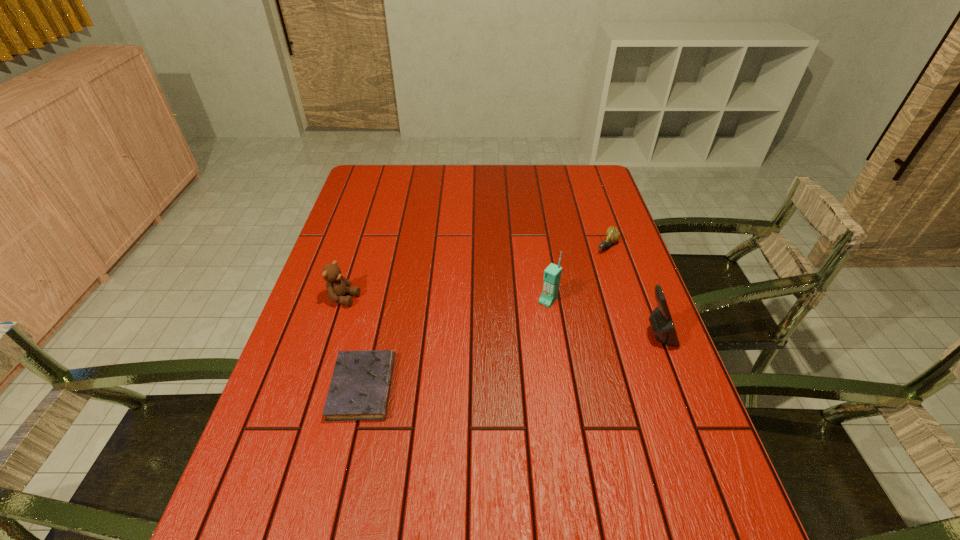
Locate an element on the screen. object that can be found as the closest to the nearer cellular telephone is located at coordinates (552, 274).

Where is `free space that satisfies the following two spatial constraints: 1. on the front side of the left cellular telephone; 2. on the front-facing side of the nearer cellular telephone`? The height and width of the screenshot is (540, 960). free space that satisfies the following two spatial constraints: 1. on the front side of the left cellular telephone; 2. on the front-facing side of the nearer cellular telephone is located at coordinates (553, 335).

This screenshot has width=960, height=540. What are the coordinates of `vacant region that satisfies the following two spatial constraints: 1. on the front side of the fourth farthest object; 2. on the front-facing side of the third shortest object` in the screenshot? It's located at (333, 335).